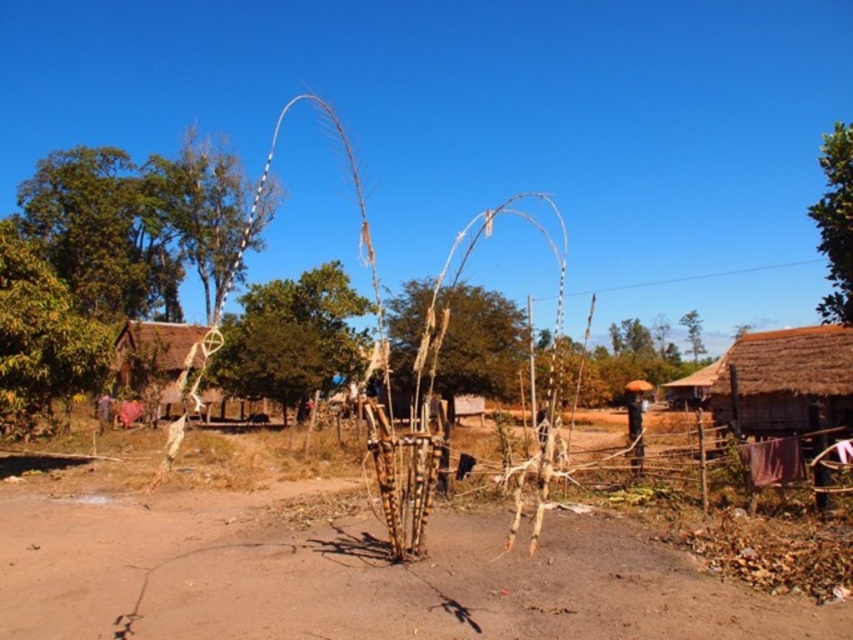
Can you confirm if brown dirt track at center is positioned above brown rough tree at center?

No.

Can you confirm if brown dirt track at center is smaller than brown rough tree at center?

Correct, brown dirt track at center occupies less space than brown rough tree at center.

Locate an element on the screen. The image size is (853, 640). brown dirt track at center is located at coordinates (357, 577).

Consider the image. Can you confirm if brown rough tree at center is thinner than thatched straw hut at left?

Indeed, brown rough tree at center has a lesser width compared to thatched straw hut at left.

Is point (405, 362) less distant than point (190, 369)?

Yes, point (405, 362) is in front of point (190, 369).

Where is `brown rough tree at center`? brown rough tree at center is located at coordinates (480, 342).

Between green leafy tree at left and green leafy tree at upper right, which one is positioned higher?

green leafy tree at upper right

Between point (67, 221) and point (840, 205), which one is positioned in front?

Positioned in front is point (840, 205).

Between point (165, 211) and point (848, 160), which one is positioned behind?

Positioned behind is point (165, 211).

At what (x,y) coordinates should I click in order to perform the action: click on green leafy tree at left. Please return your answer as a coordinate pair (x, y). This screenshot has width=853, height=640. Looking at the image, I should click on (134, 225).